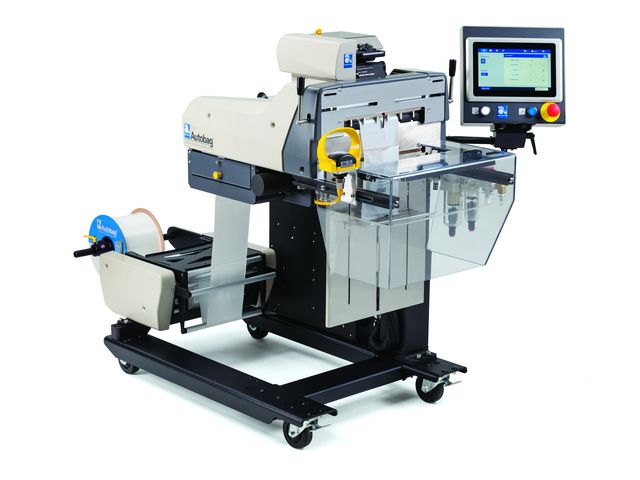
The width and height of the screenshot is (640, 480). Find the location of `screen`. screen is located at coordinates (518, 70).